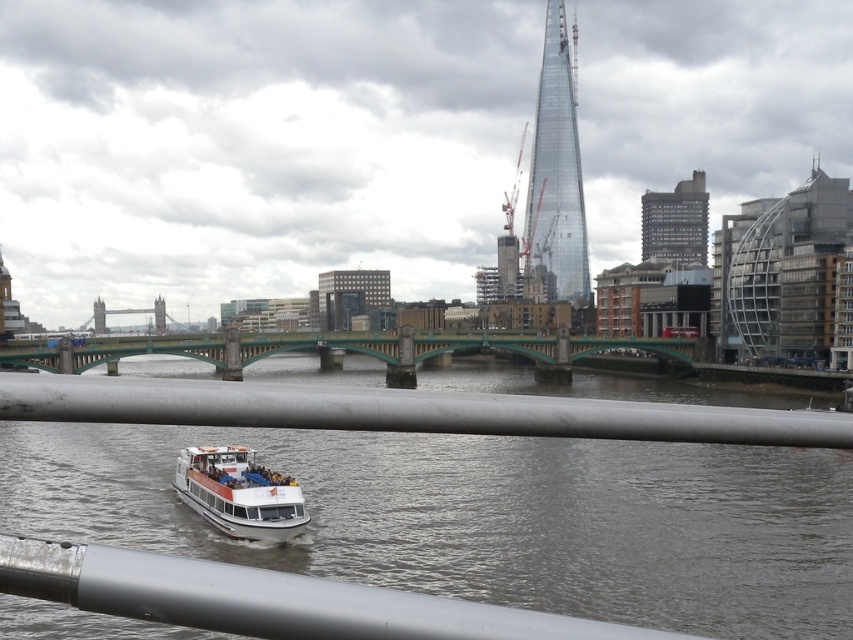
Question: In this image, where is glassy modern building at right located relative to gray concrete building at center?

Choices:
 (A) above
 (B) below

Answer: (A)

Question: Considering the real-world distances, which object is closest to the white matte water at center?

Choices:
 (A) dark gray concrete building at upper right
 (B) transparent glass tower at upper center

Answer: (A)

Question: Among these points, which one is farthest from the camera?

Choices:
 (A) (734, 330)
 (B) (752, 548)
 (C) (839, 416)
 (D) (25, 364)

Answer: (A)

Question: Does green metallic bridge at center appear over white matte boat at lower center?

Choices:
 (A) no
 (B) yes

Answer: (B)

Question: Does transparent glass tower at upper center have a smaller size compared to gray concrete building at center?

Choices:
 (A) yes
 (B) no

Answer: (B)

Question: Which object is positioned closest to the silver metallic railing at center?

Choices:
 (A) glassy modern building at right
 (B) gray concrete building at center
 (C) transparent glass tower at upper center

Answer: (A)